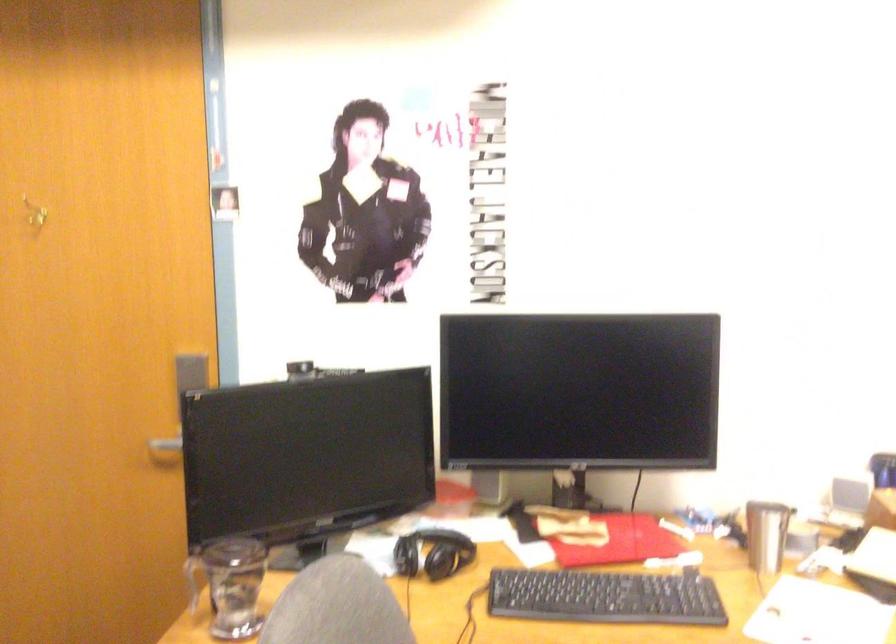
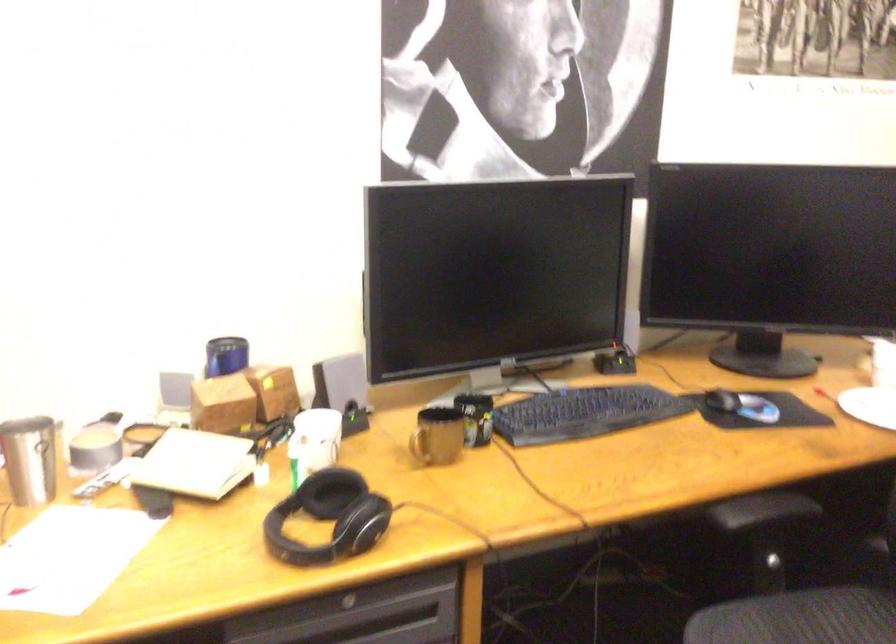
Question: The first image is from the beginning of the video and the second image is from the end. How did the camera likely rotate when shooting the video?

Choices:
 (A) Left
 (B) Right
 (C) Up
 (D) Down

Answer: (B)